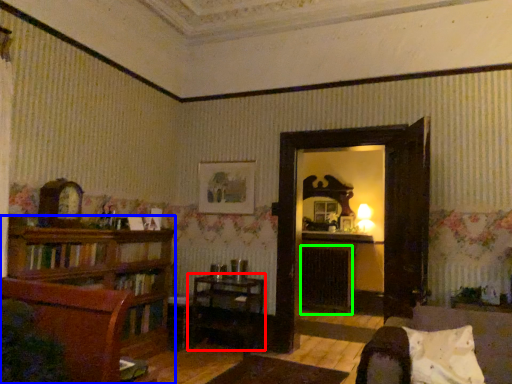
Question: Estimate the real-world distances between objects in this image. Which object is closer to table (highlighted by a red box), shelf (highlighted by a blue box) or fireplace (highlighted by a green box)?

Choices:
 (A) shelf
 (B) fireplace

Answer: (A)